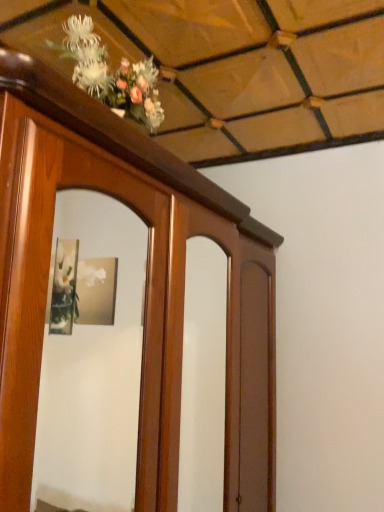
Where is `brown polished wood cabinet at upper left`? Image resolution: width=384 pixels, height=512 pixels. brown polished wood cabinet at upper left is located at coordinates (146, 285).

Describe the element at coordinates (146, 285) in the screenshot. I see `brown polished wood cabinet at upper left` at that location.

The image size is (384, 512). Find the location of `brown polished wood cabinet at upper left`. brown polished wood cabinet at upper left is located at coordinates (146, 285).